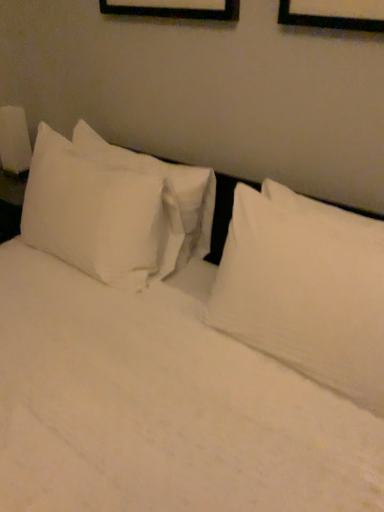
Question: Based on their sizes in the image, would you say white soft pillow at upper right, which is the second pillow from left to right, is bigger or smaller than white glossy lampshade at left?

Choices:
 (A) small
 (B) big

Answer: (B)

Question: Considering the positions of white soft pillow at upper right, the 1th pillow positioned from the right, and white glossy lampshade at left in the image, is white soft pillow at upper right, the 1th pillow positioned from the right, wider or thinner than white glossy lampshade at left?

Choices:
 (A) wide
 (B) thin

Answer: (A)

Question: Which of these objects is positioned farthest from the white glossy lampshade at left?

Choices:
 (A) white soft pillow at upper right, the 1th pillow positioned from the right
 (B) white cotton pillow at left, which appears as the first pillow when viewed from the left

Answer: (A)

Question: Estimate the real-world distances between objects in this image. Which object is closer to the white glossy lampshade at left?

Choices:
 (A) white cotton pillow at left, which appears as the first pillow when viewed from the left
 (B) white soft pillow at upper right, the 1th pillow positioned from the right

Answer: (A)